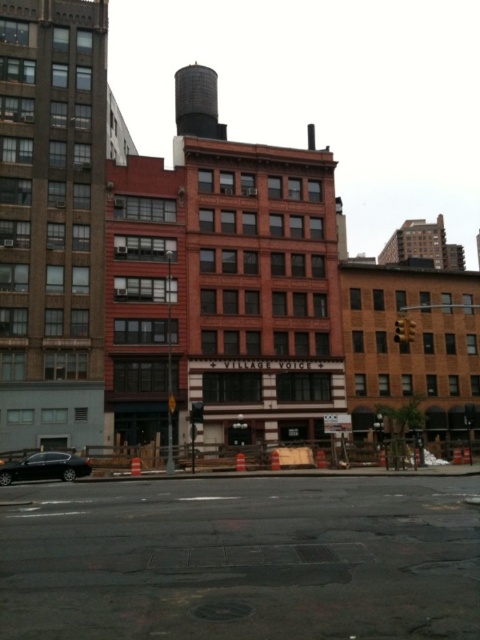
Question: Among these points, which one is farthest from the camera?

Choices:
 (A) (156, 540)
 (B) (225, 124)
 (C) (40, 460)

Answer: (B)

Question: Is black textured water tower at upper center positioned behind shiny black sedan at lower left?

Choices:
 (A) yes
 (B) no

Answer: (A)

Question: Which of these objects is positioned closest to the black asphalt at center?

Choices:
 (A) shiny black sedan at lower left
 (B) black textured water tower at upper center

Answer: (A)

Question: Is black asphalt at center further to camera compared to shiny black sedan at lower left?

Choices:
 (A) no
 (B) yes

Answer: (A)

Question: Which point is farther to the camera?

Choices:
 (A) shiny black sedan at lower left
 (B) black asphalt at center

Answer: (A)

Question: Observing the image, what is the correct spatial positioning of black asphalt at center in reference to black textured water tower at upper center?

Choices:
 (A) below
 (B) above

Answer: (A)